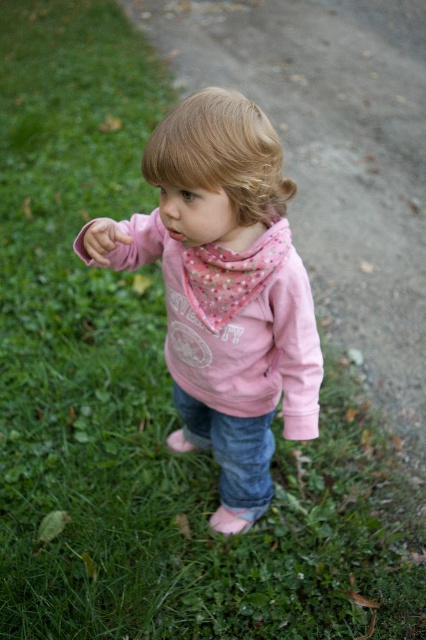
The child is pointing at an object off the image. If you were to walk from the blonde silky hair at center to the pink cotton hoodie at center, which direction would you move relative to the child?

Since the blonde silky hair at center is behind the pink cotton hoodie at center, you would move forward towards the pink cotton hoodie at center to reach it from the blonde silky hair at center.

The child in the image is wearing a pink cotton hoodie at center and has blonde silky hair at center. Which of these two items is larger in size?

The pink cotton hoodie at center is bigger than the blonde silky hair at center.

The child is wearing a pink cotton hoodie at center and has a matte pink hand at center. Which item is located to the right of the other?

The pink cotton hoodie at center is positioned on the right side of matte pink hand at center.